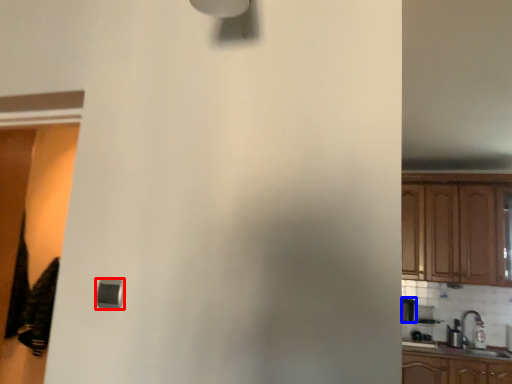
Question: Which object appears farthest to the camera in this image, light (highlighted by a red box) or appliance (highlighted by a blue box)?

Choices:
 (A) light
 (B) appliance

Answer: (B)